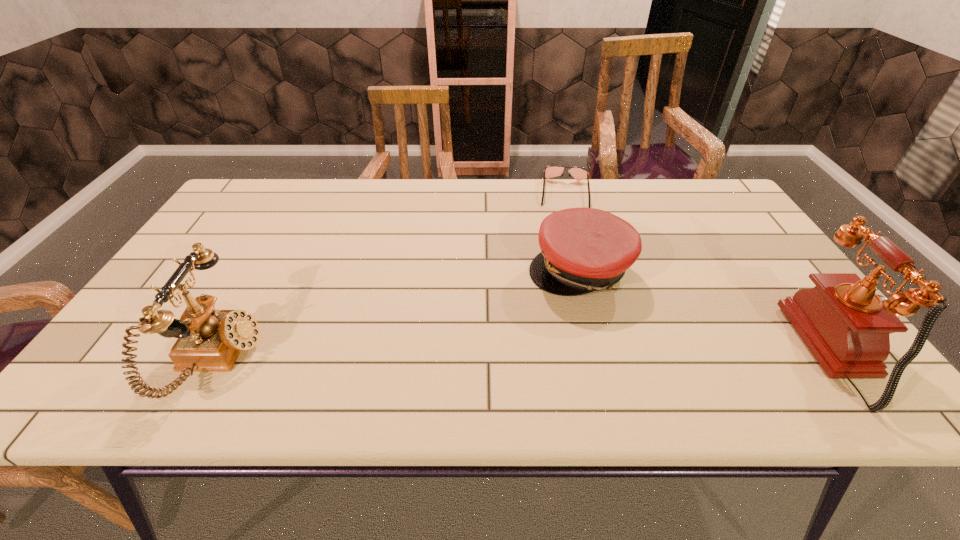
At what (x,y) coordinates should I click in order to perform the action: click on free spot between the right telephone and the farthest object. Please return your answer as a coordinate pair (x, y). The height and width of the screenshot is (540, 960). Looking at the image, I should click on (704, 273).

The width and height of the screenshot is (960, 540). In order to click on vacant space that's between the third shortest object and the rightmost object in this screenshot , I will do `click(530, 356)`.

Identify the location of free point between the rightmost object and the farthest object. (704, 273).

Where is `blank region between the rightmost object and the second shortest object`? This screenshot has width=960, height=540. blank region between the rightmost object and the second shortest object is located at coordinates (711, 311).

The height and width of the screenshot is (540, 960). Find the location of `object that is the third closest one to the shorter telephone`. object that is the third closest one to the shorter telephone is located at coordinates (846, 326).

At what (x,y) coordinates should I click in order to perform the action: click on object that is the second nearest to the shortest object. Please return your answer as a coordinate pair (x, y). This screenshot has height=540, width=960. Looking at the image, I should click on (846, 326).

Where is `vacant space that satisfies the following two spatial constraints: 1. on the front side of the right telephone; 2. on the dial of the cap`? This screenshot has width=960, height=540. vacant space that satisfies the following two spatial constraints: 1. on the front side of the right telephone; 2. on the dial of the cap is located at coordinates (601, 353).

Where is `vacant area that satisfies the following two spatial constraints: 1. on the front side of the second shortest object; 2. on the dial of the tallest object`? This screenshot has width=960, height=540. vacant area that satisfies the following two spatial constraints: 1. on the front side of the second shortest object; 2. on the dial of the tallest object is located at coordinates (601, 353).